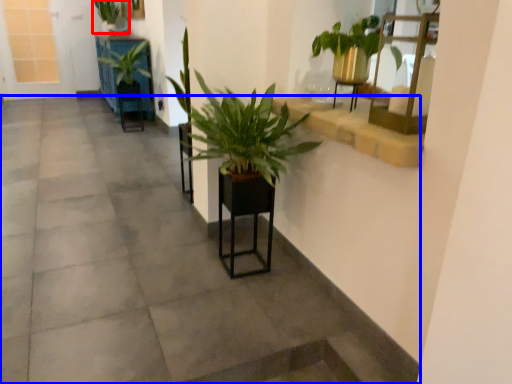
Question: Which point is further to the camera, houseplant (highlighted by a red box) or concrete (highlighted by a blue box)?

Choices:
 (A) houseplant
 (B) concrete

Answer: (A)